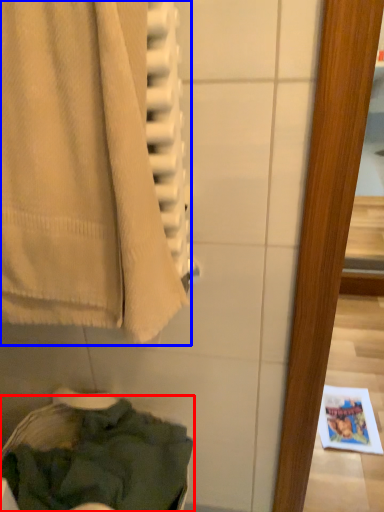
Question: Among these objects, which one is farthest to the camera, clothing (highlighted by a red box) or towel (highlighted by a blue box)?

Choices:
 (A) clothing
 (B) towel

Answer: (A)